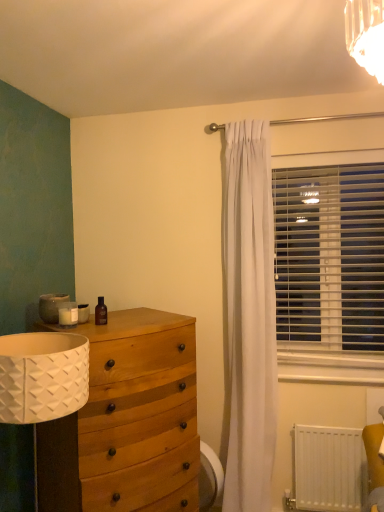
Question: Looking at the image, does white matte radiator at lower right seem bigger or smaller compared to white plastic blinds at right?

Choices:
 (A) big
 (B) small

Answer: (B)

Question: Does point (344, 451) appear closer or farther from the camera than point (327, 280)?

Choices:
 (A) closer
 (B) farther

Answer: (A)

Question: Considering the real-world distances, which object is farthest from the white plastic swivel chair at lower right?

Choices:
 (A) white matte radiator at lower right
 (B) white plastic blinds at right
 (C) wooden chest of drawers at left
 (D) brown glass bottle at upper left

Answer: (B)

Question: Estimate the real-world distances between objects in this image. Which object is closer to the brown glass bottle at upper left?

Choices:
 (A) white plastic swivel chair at lower right
 (B) white plastic blinds at right
 (C) wooden chest of drawers at left
 (D) white matte radiator at lower right

Answer: (C)